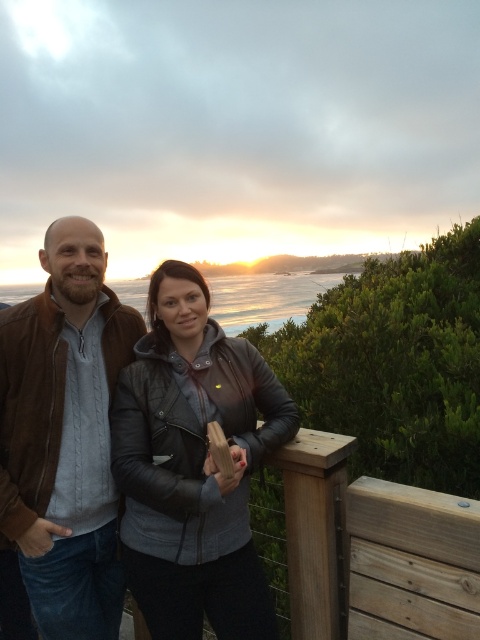
You are a tailor measuring jackets for alterations. You need to determine if the space between the leather jacket at center and the brown leather jacket at left is sufficient to place a 12 inch ruler between them. Can you fit the ruler horizontally between them?

The distance between the leather jacket at center and the brown leather jacket at left is 13.57 inches. Since the ruler is 12 inches long, it can fit horizontally between them as there is enough space.

You are a photographer trying to capture the blue ocean at center while avoiding the brown leather jacket at left from blocking the view. Based on the scene, is the jacket positioned in a way that it might obstruct the ocean in your photo?

Yes, the brown leather jacket at left is in front of the blue ocean at center, so it will block the ocean in the photo unless moved or reframed.

You are a photographer trying to capture a shot of the leather jacket at center and the blue ocean at center. Which object is closer to the camera based on their positions?

The leather jacket at center is positioned under the blue ocean at center, so the leather jacket is closer to the camera.